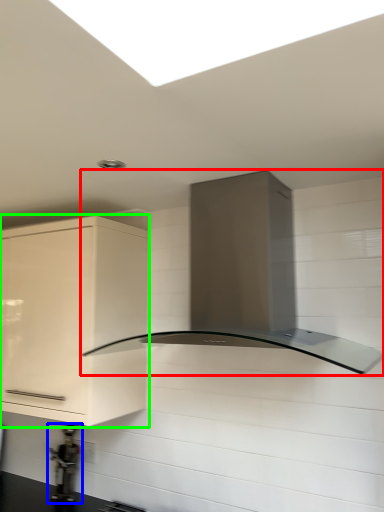
Question: Estimate the real-world distances between objects in this image. Which object is closer to home appliance (highlighted by a red box), appliance (highlighted by a blue box) or cabinetry (highlighted by a green box)?

Choices:
 (A) appliance
 (B) cabinetry

Answer: (B)